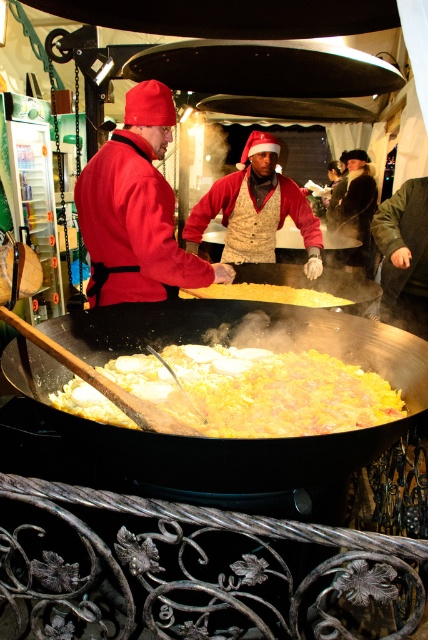
Question: Which object is farther from the camera taking this photo?

Choices:
 (A) yellow rice at center
 (B) yellow matte food at center
 (C) yellow matte wok at center
 (D) matte red coat at center

Answer: (C)

Question: Can you confirm if yellow rice at center is positioned below matte red coat at center?

Choices:
 (A) no
 (B) yes

Answer: (B)

Question: Which point is closer to the camera?

Choices:
 (A) (374, 282)
 (B) (112, 204)
 (C) (291, 292)
 (D) (403, 413)

Answer: (D)

Question: Which is farther from the matte red coat at center?

Choices:
 (A) yellow matte food at center
 (B) yellow rice at center

Answer: (B)

Question: Is yellow rice at center to the left of matte red coat at center from the viewer's perspective?

Choices:
 (A) no
 (B) yes

Answer: (A)

Question: Can you confirm if black matte wok at center is thinner than yellow matte food at center?

Choices:
 (A) no
 (B) yes

Answer: (A)